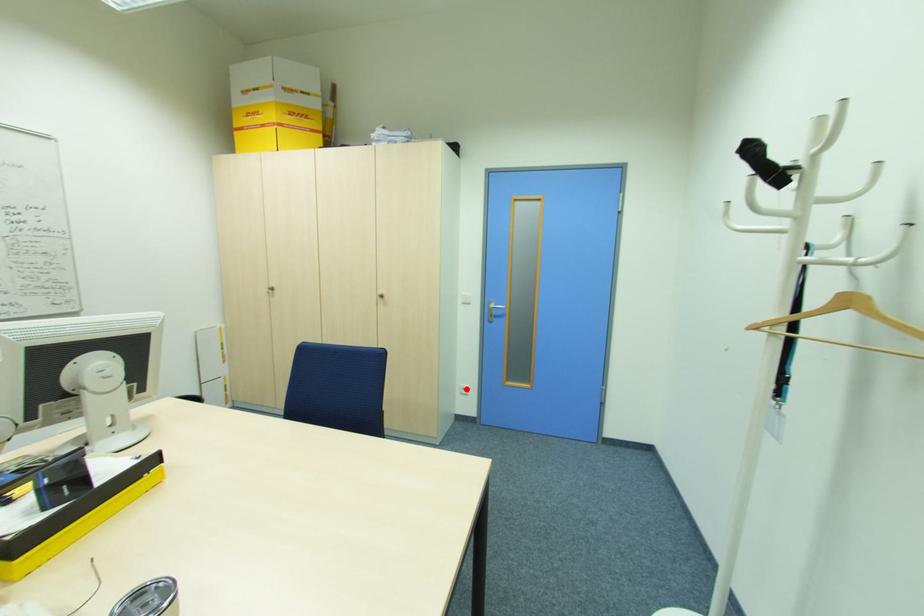
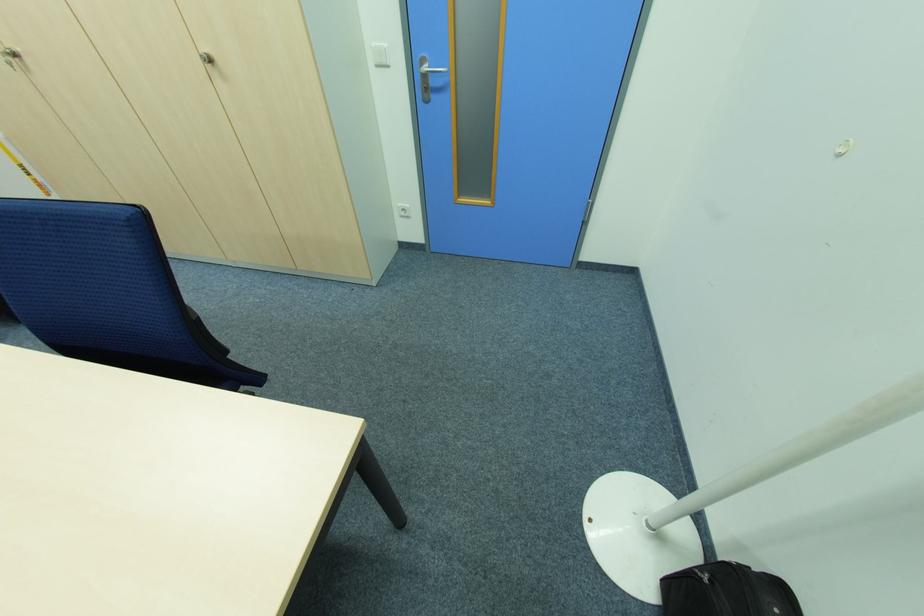
Where in the second image is the point corresponding to the highlighted location from the first image?

(407, 209)